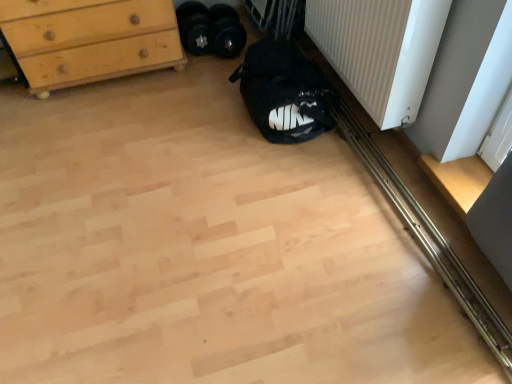
Based on the photo, what is the approximate height of light wood chest of drawers at upper left?

It is 20.56 inches.

The width and height of the screenshot is (512, 384). What are the coordinates of `white ribbed radiator at lower right` in the screenshot? It's located at (380, 50).

You are a GUI agent. You are given a task and a screenshot of the screen. Output one action in this format:
    pyautogui.click(x=<x>, y=<y>)
    Task: Click on the black fabric shoe at center, which appears as the 1th footwear when viewed from the right
    
    Given the screenshot: What is the action you would take?
    pyautogui.click(x=210, y=29)

Would you say black fabric sleeping bag at lower center is a long distance from black rubber weights at center, positioned as the first footwear in left-to-right order?

black fabric sleeping bag at lower center is near black rubber weights at center, positioned as the first footwear in left-to-right order, not far away.

Is point (316, 90) behind point (201, 11)?

No, (316, 90) is closer to viewer.

From a real-world perspective, is black fabric sleeping bag at lower center beneath black rubber weights at center, positioned as the first footwear in left-to-right order?

No, from a real-world perspective, black fabric sleeping bag at lower center is not beneath black rubber weights at center, positioned as the first footwear in left-to-right order.

From a real-world perspective, does black rubber weights at center, marked as the 2th footwear in a right-to-left arrangement, stand above white ribbed radiator at lower right?

No, from a real-world perspective, black rubber weights at center, marked as the 2th footwear in a right-to-left arrangement, is not over white ribbed radiator at lower right

Considering the sizes of black rubber weights at center, marked as the 2th footwear in a right-to-left arrangement, and white ribbed radiator at lower right in the image, is black rubber weights at center, marked as the 2th footwear in a right-to-left arrangement, taller or shorter than white ribbed radiator at lower right?

In the image, black rubber weights at center, marked as the 2th footwear in a right-to-left arrangement, appears to be shorter than white ribbed radiator at lower right.

Choose the correct answer: Is black rubber weights at center, marked as the 2th footwear in a right-to-left arrangement, inside white ribbed radiator at lower right or outside it?

black rubber weights at center, marked as the 2th footwear in a right-to-left arrangement, lies outside white ribbed radiator at lower right.

Is black rubber weights at center, positioned as the first footwear in left-to-right order, at the right side of white ribbed radiator at lower right?

No.

Based on the photo, is black fabric sleeping bag at lower center shorter than light wood chest of drawers at upper left?

Yes.

Locate an element on the screen. The image size is (512, 384). sleeping bag lying in front of the light wood chest of drawers at upper left is located at coordinates [x=283, y=92].

Is black fabric sleeping bag at lower center inside the boundaries of light wood chest of drawers at upper left, or outside?

black fabric sleeping bag at lower center exists outside the volume of light wood chest of drawers at upper left.

Which object is thinner, black fabric sleeping bag at lower center or light wood chest of drawers at upper left?

With smaller width is light wood chest of drawers at upper left.

In the image, is white ribbed radiator at lower right on the left side or the right side of black fabric shoe at center, which appears as the 2th footwear when viewed from the left?

white ribbed radiator at lower right is to the right of black fabric shoe at center, which appears as the 2th footwear when viewed from the left.

Is white ribbed radiator at lower right aimed at black fabric shoe at center, which appears as the 2th footwear when viewed from the left?

No, white ribbed radiator at lower right does not turn towards black fabric shoe at center, which appears as the 2th footwear when viewed from the left.

From the image's perspective, who appears lower, white ribbed radiator at lower right or black fabric shoe at center, which appears as the 2th footwear when viewed from the left?

white ribbed radiator at lower right, from the image's perspective.

From a real-world perspective, is white ribbed radiator at lower right above or below black fabric shoe at center, which appears as the 1th footwear when viewed from the right?

Clearly, from a real-world perspective, white ribbed radiator at lower right is above black fabric shoe at center, which appears as the 1th footwear when viewed from the right.

From a real-world perspective, is black fabric sleeping bag at lower center positioned under black fabric shoe at center, which appears as the 1th footwear when viewed from the right, based on gravity?

No, from a real-world perspective, black fabric sleeping bag at lower center is not below black fabric shoe at center, which appears as the 1th footwear when viewed from the right.

Considering the sizes of objects black fabric sleeping bag at lower center and black fabric shoe at center, which appears as the 1th footwear when viewed from the right, in the image provided, who is wider, black fabric sleeping bag at lower center or black fabric shoe at center, which appears as the 1th footwear when viewed from the right,?

With larger width is black fabric sleeping bag at lower center.

Is point (286, 44) closer to camera compared to point (197, 33)?

That is True.

Is black fabric sleeping bag at lower center located outside black fabric shoe at center, which appears as the 2th footwear when viewed from the left?

That's correct, black fabric sleeping bag at lower center is outside of black fabric shoe at center, which appears as the 2th footwear when viewed from the left.

Considering the sizes of objects light wood chest of drawers at upper left and black fabric sleeping bag at lower center in the image provided, who is smaller, light wood chest of drawers at upper left or black fabric sleeping bag at lower center?

Smaller between the two is black fabric sleeping bag at lower center.

Does light wood chest of drawers at upper left appear on the right side of black fabric sleeping bag at lower center?

Incorrect, light wood chest of drawers at upper left is not on the right side of black fabric sleeping bag at lower center.

Between light wood chest of drawers at upper left and black fabric sleeping bag at lower center, which one has less height?

black fabric sleeping bag at lower center.

How different are the orientations of black fabric shoe at center, which appears as the 2th footwear when viewed from the left, and light wood chest of drawers at upper left in degrees?

The angular difference between black fabric shoe at center, which appears as the 2th footwear when viewed from the left, and light wood chest of drawers at upper left is 2.57 degrees.

Which object is more forward, black fabric shoe at center, which appears as the 1th footwear when viewed from the right, or light wood chest of drawers at upper left?

light wood chest of drawers at upper left.

From a real-world perspective, relative to light wood chest of drawers at upper left, is black fabric shoe at center, which appears as the 1th footwear when viewed from the right, vertically above or below?

In terms of real-world spatial position, black fabric shoe at center, which appears as the 1th footwear when viewed from the right, is below light wood chest of drawers at upper left.

The height and width of the screenshot is (384, 512). In order to click on sleeping bag that appears below the black rubber weights at center, marked as the 2th footwear in a right-to-left arrangement (from the image's perspective) in this screenshot , I will do pyautogui.click(x=283, y=92).

There is a white ribbed radiator at lower right. Identify the location of the 2nd footwear above it (from the image's perspective). The height and width of the screenshot is (384, 512). (194, 27).

Considering their positions, is light wood chest of drawers at upper left positioned further to black rubber weights at center, marked as the 2th footwear in a right-to-left arrangement, than black fabric sleeping bag at lower center?

black fabric sleeping bag at lower center is positioned further to the anchor black rubber weights at center, marked as the 2th footwear in a right-to-left arrangement.

Based on their spatial positions, is white ribbed radiator at lower right or black fabric sleeping bag at lower center closer to light wood chest of drawers at upper left?

The object closer to light wood chest of drawers at upper left is black fabric sleeping bag at lower center.

When comparing their distances from black rubber weights at center, positioned as the first footwear in left-to-right order, does black fabric shoe at center, which appears as the 2th footwear when viewed from the left, or light wood chest of drawers at upper left seem closer?

black fabric shoe at center, which appears as the 2th footwear when viewed from the left, is positioned closer to the anchor black rubber weights at center, positioned as the first footwear in left-to-right order.

Which object lies further to the anchor point light wood chest of drawers at upper left, black fabric sleeping bag at lower center or white ribbed radiator at lower right?

white ribbed radiator at lower right.

Based on their spatial positions, is black rubber weights at center, marked as the 2th footwear in a right-to-left arrangement, or black fabric shoe at center, which appears as the 1th footwear when viewed from the right, closer to black fabric sleeping bag at lower center?

black fabric shoe at center, which appears as the 1th footwear when viewed from the right, is positioned closer to the anchor black fabric sleeping bag at lower center.

Which object lies nearer to the anchor point light wood chest of drawers at upper left, black rubber weights at center, positioned as the first footwear in left-to-right order, or black fabric shoe at center, which appears as the 1th footwear when viewed from the right?

Based on the image, black fabric shoe at center, which appears as the 1th footwear when viewed from the right, appears to be nearer to light wood chest of drawers at upper left.

When comparing their distances from black fabric shoe at center, which appears as the 2th footwear when viewed from the left, does black rubber weights at center, marked as the 2th footwear in a right-to-left arrangement, or light wood chest of drawers at upper left seem further?

Based on the image, light wood chest of drawers at upper left appears to be further to black fabric shoe at center, which appears as the 2th footwear when viewed from the left.

Considering their positions, is light wood chest of drawers at upper left positioned further to black fabric sleeping bag at lower center than black rubber weights at center, marked as the 2th footwear in a right-to-left arrangement?

light wood chest of drawers at upper left lies further to black fabric sleeping bag at lower center than the other object.

Find the location of `footwear located between black fabric sleeping bag at lower center and black rubber weights at center, marked as the 2th footwear in a right-to-left arrangement, in the depth direction`. footwear located between black fabric sleeping bag at lower center and black rubber weights at center, marked as the 2th footwear in a right-to-left arrangement, in the depth direction is located at coordinates (210, 29).

At what (x,y) coordinates should I click in order to perform the action: click on sleeping bag between white ribbed radiator at lower right and black rubber weights at center, marked as the 2th footwear in a right-to-left arrangement, along the z-axis. Please return your answer as a coordinate pair (x, y). This screenshot has width=512, height=384. Looking at the image, I should click on (283, 92).

This screenshot has height=384, width=512. In order to click on footwear located between white ribbed radiator at lower right and black rubber weights at center, positioned as the first footwear in left-to-right order, in the depth direction in this screenshot , I will do `click(210, 29)`.

At what (x,y) coordinates should I click in order to perform the action: click on footwear between light wood chest of drawers at upper left and black fabric shoe at center, which appears as the 2th footwear when viewed from the left. Please return your answer as a coordinate pair (x, y). Looking at the image, I should click on (194, 27).